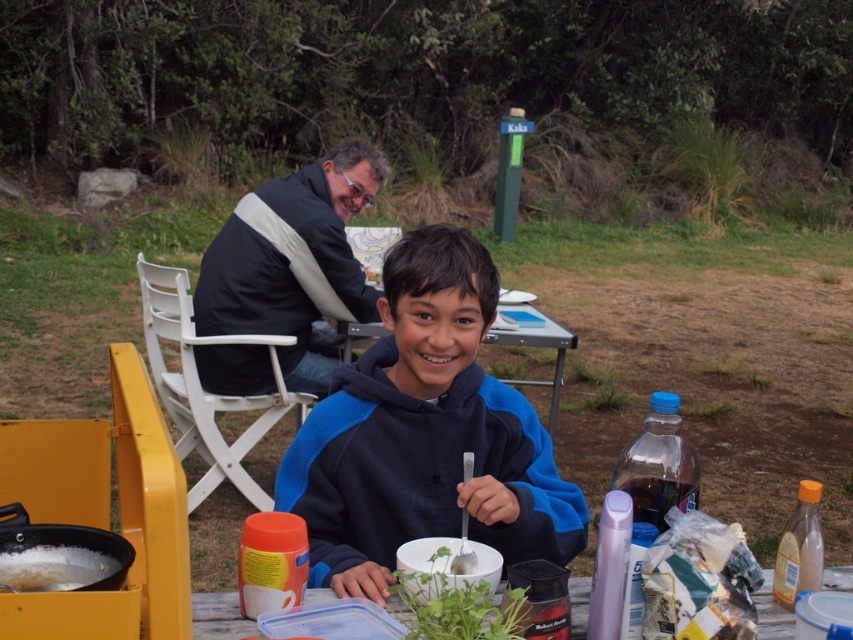
Question: Can you confirm if blue fleece jacket at center is positioned to the right of white plastic picnic table at center?

Choices:
 (A) yes
 (B) no

Answer: (B)

Question: Is clear plastic container at center above white matte pot at lower left?

Choices:
 (A) yes
 (B) no

Answer: (B)

Question: Is clear plastic container at center bigger than white matte pot at lower left?

Choices:
 (A) yes
 (B) no

Answer: (A)

Question: Which point is farther from the camera taking this photo?

Choices:
 (A) (514, 346)
 (B) (248, 620)
 (C) (404, 362)
 (D) (3, 573)

Answer: (A)

Question: Among these points, which one is farthest from the camera?

Choices:
 (A) (534, 314)
 (B) (271, 179)
 (C) (515, 518)

Answer: (B)

Question: Which point is farther to the camera?

Choices:
 (A) clear plastic container at center
 (B) white plastic picnic table at center
 (C) white matte pot at lower left

Answer: (B)